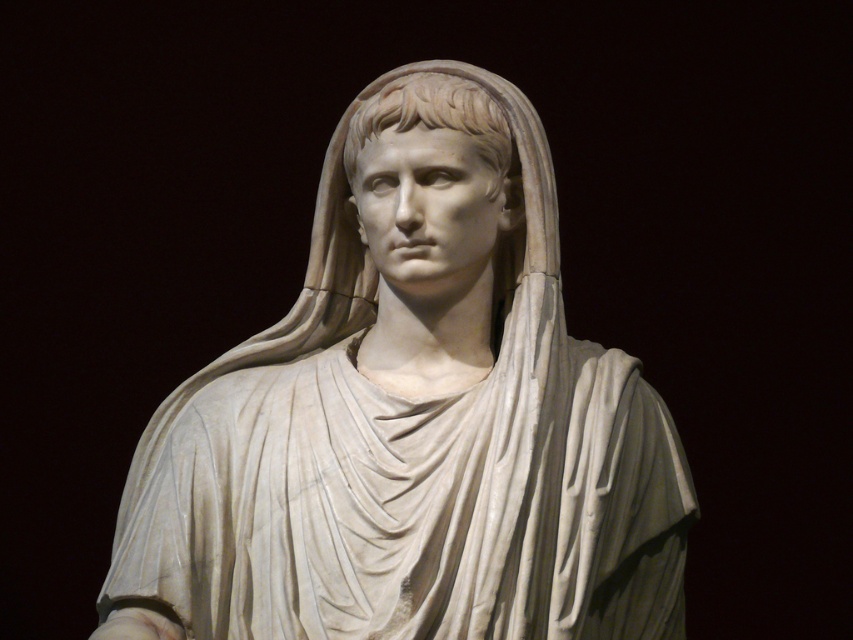
You are standing in front of the white marble statue at center. If you want to take a photo of it with your phone, which has a maximum focus range of 4 meters, will you need to step back further to ensure it is in focus?

The white marble statue at center is 4.34 meters away from the viewer. Since the phone can only focus up to 4 meters, you need to step back further to increase the distance so the statue is within the focus range.

In the scene shown: You are an art conservator examining the white marble statue at center and the white marble head at center. Which object is significantly taller?

The white marble statue at center is much taller than the white marble head at center.

You are an art conservator assessing the dimensions of the statue. Given that the white marble head at center is 30 cm wide, can you determine if the white marble statue at center will fit through a doorway that is 1 meter wide?

The white marble statue at center is wider than the white marble head at center, which is 30 cm wide. Since the statue is wider than 30 cm, and the doorway is 1 meter wide, the statue will fit through the doorway as 1 meter is significantly wider than the statue.